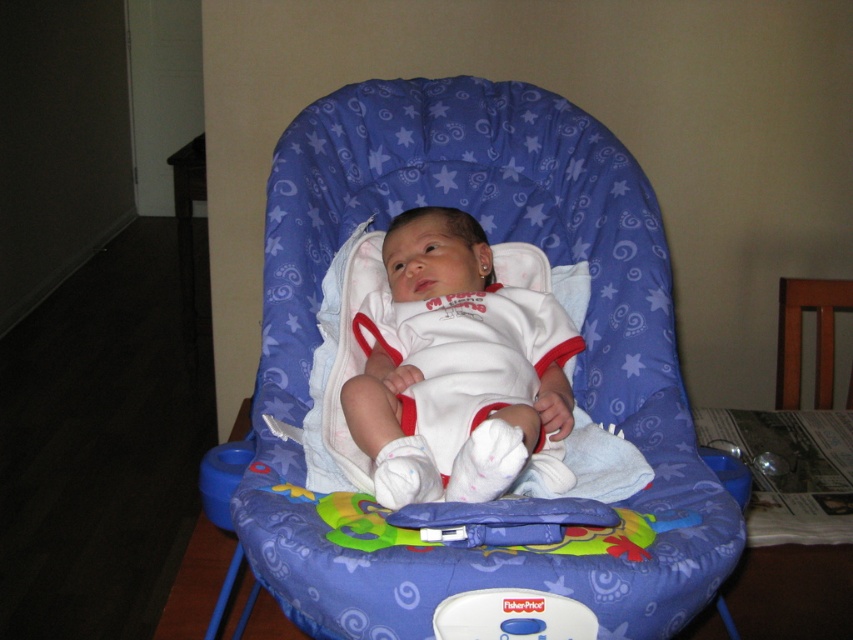
Question: Which of the following is the farthest from the observer?

Choices:
 (A) tap(471, 244)
 (B) tap(497, 628)
 (C) tap(477, 81)

Answer: (C)

Question: Which object is the closest to the brown wood chair at right?

Choices:
 (A) white soft fabric baby at center
 (B) blue fabric baby carriage at center
 (C) blue plastic fisher-price toy at center

Answer: (B)

Question: Based on their relative distances, which object is farther from the blue plastic fisher-price toy at center?

Choices:
 (A) brown wood chair at right
 (B) white soft fabric baby at center
 (C) blue fabric baby carriage at center

Answer: (A)

Question: Does blue fabric baby carriage at center lie in front of brown wood chair at right?

Choices:
 (A) no
 (B) yes

Answer: (B)

Question: Does blue fabric baby carriage at center come in front of brown wood chair at right?

Choices:
 (A) no
 (B) yes

Answer: (B)

Question: Does white soft fabric baby at center have a smaller size compared to brown wood chair at right?

Choices:
 (A) no
 (B) yes

Answer: (A)